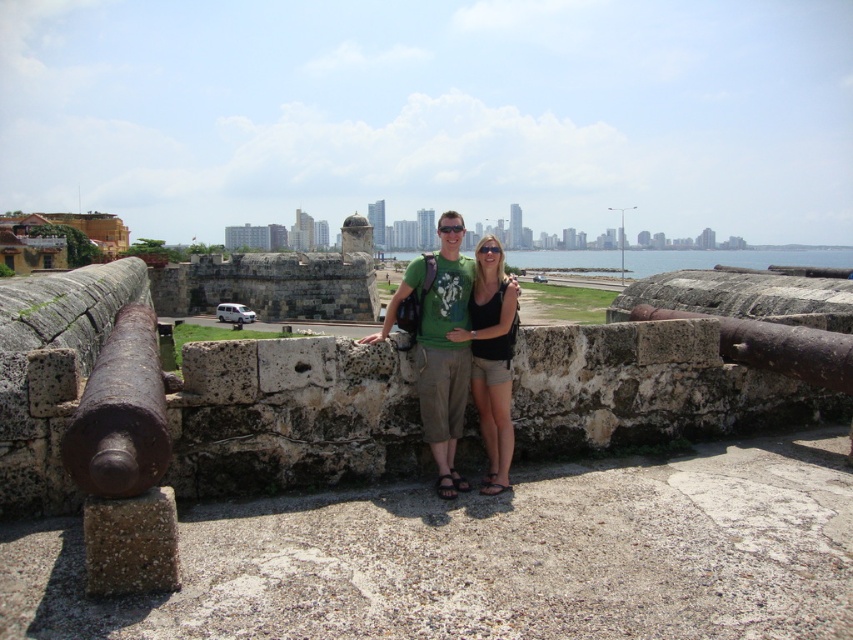
Question: Is green matte t-shirt at center behind blue water at center?

Choices:
 (A) yes
 (B) no

Answer: (B)

Question: Which of the following is the farthest from the observer?

Choices:
 (A) (456, 211)
 (B) (838, 252)

Answer: (B)

Question: Observing the image, what is the correct spatial positioning of black fabric shorts at center in reference to blue water at center?

Choices:
 (A) right
 (B) left

Answer: (B)

Question: Which object appears farthest from the camera in this image?

Choices:
 (A) black fabric shorts at center
 (B) green matte t-shirt at center
 (C) rusty metal cannon at left
 (D) blue water at center

Answer: (D)

Question: Where is green matte t-shirt at center located in relation to black fabric shorts at center in the image?

Choices:
 (A) left
 (B) right

Answer: (A)

Question: Which object is farther from the camera taking this photo?

Choices:
 (A) black fabric shorts at center
 (B) blue water at center
 (C) rusty metal cannon at left

Answer: (B)